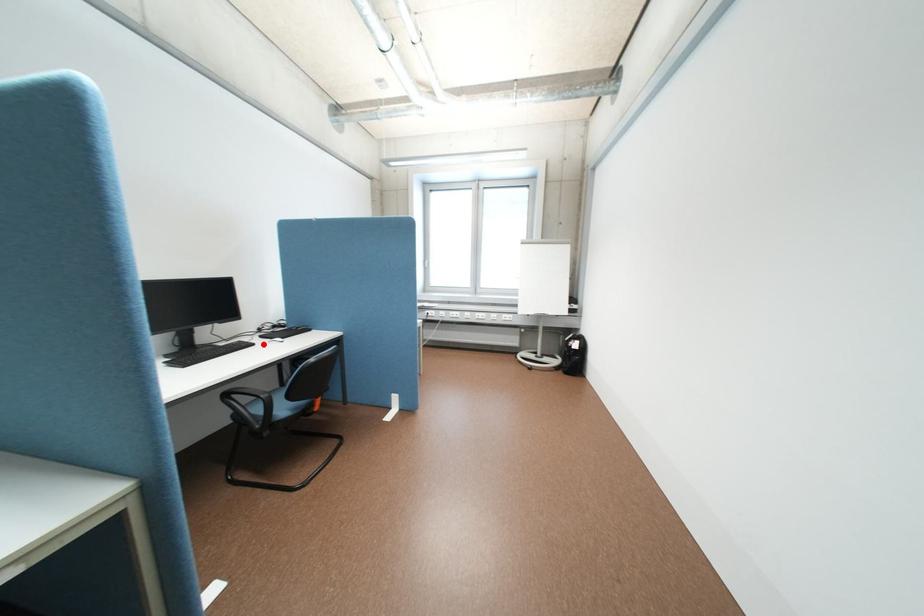
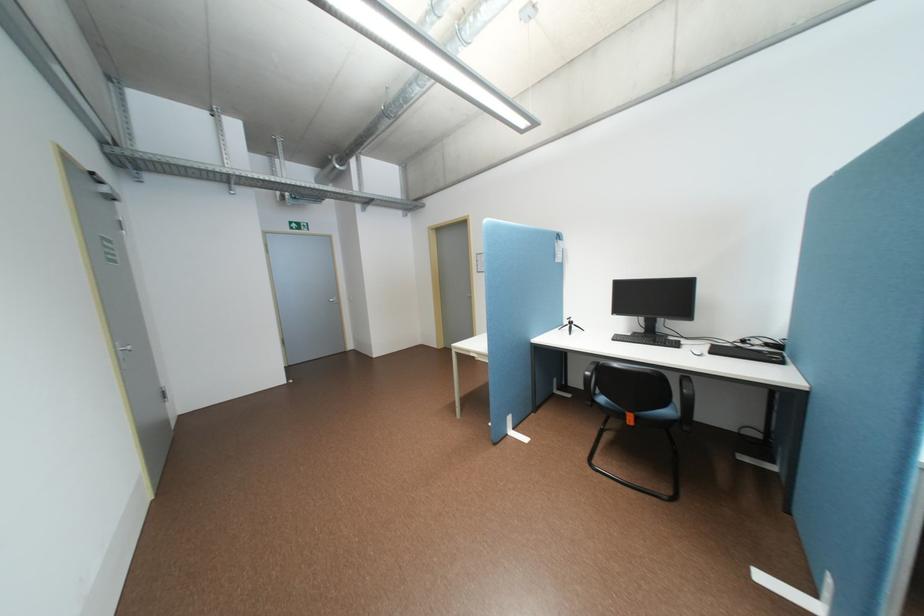
Locate, in the second image, the point that corresponds to the highlighted location in the first image.

(688, 346)